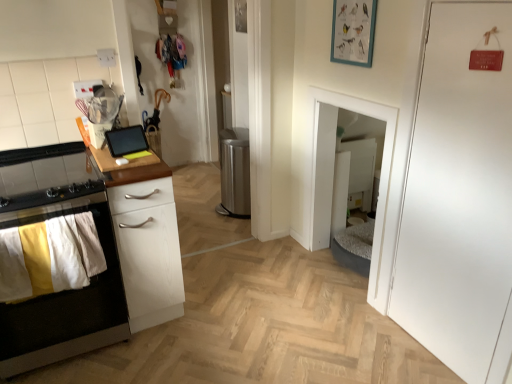
This screenshot has height=384, width=512. Identify the location of vacant space that is in between white matte door at right and white matte cabinet at left. (267, 340).